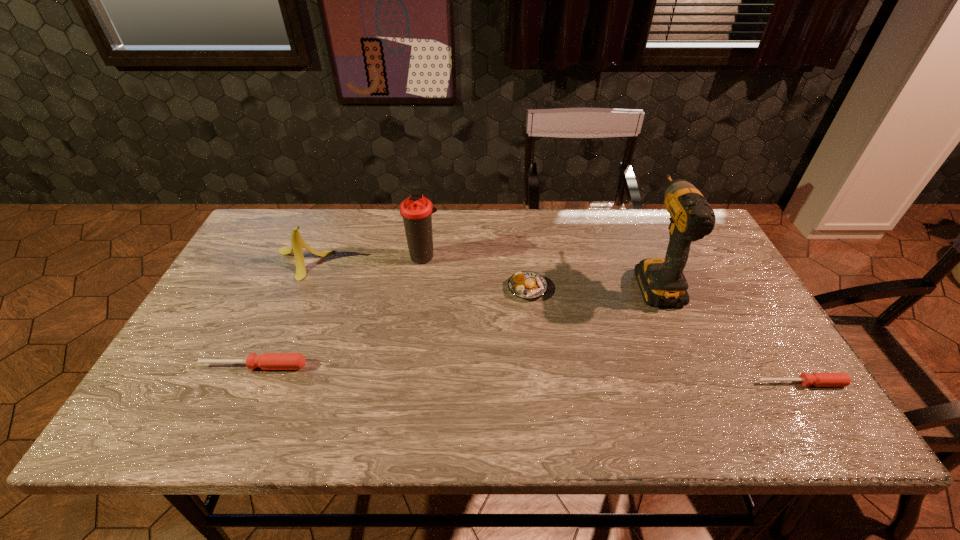
The height and width of the screenshot is (540, 960). I want to click on vacant point located between the pastry and the farther screwdriver, so click(391, 327).

Locate an element on the screen. Image resolution: width=960 pixels, height=540 pixels. free area in between the nearest object and the fourth object from left to right is located at coordinates (664, 336).

Where is `free space between the nearest object and the fourth object from left to right`? Image resolution: width=960 pixels, height=540 pixels. free space between the nearest object and the fourth object from left to right is located at coordinates (664, 336).

You are a GUI agent. You are given a task and a screenshot of the screen. Output one action in this format:
    pyautogui.click(x=<x>, y=<y>)
    Task: Click on the empty space between the pastry and the thermos bottle
    
    Given the screenshot: What is the action you would take?
    pyautogui.click(x=475, y=272)

Locate which object ranks fourth in proximity to the fourth object from right to left. Please provide its 2D coordinates. Your answer should be formatted as a tuple, i.e. [(x, y)], where the tuple contains the x and y coordinates of a point satisfying the conditions above.

[(661, 280)]

At what (x,y) coordinates should I click in order to perform the action: click on object that is the fifth closest one to the pastry. Please return your answer as a coordinate pair (x, y). The height and width of the screenshot is (540, 960). Looking at the image, I should click on (267, 361).

What are the coordinates of `blank space that satisfies the following two spatial constraints: 1. on the back side of the third tallest object; 2. on the left side of the farther screwdriver` in the screenshot? It's located at (300, 264).